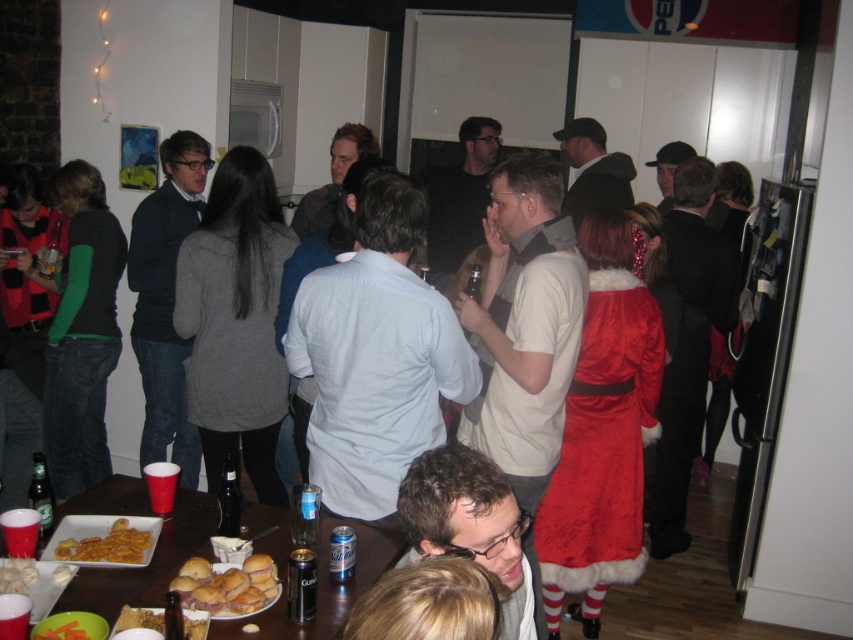
Question: Does clear glass beer at table center have a smaller size compared to golden crispy fries at lower left?

Choices:
 (A) no
 (B) yes

Answer: (A)

Question: Among these points, which one is nearest to the camera?

Choices:
 (A) (204, 564)
 (B) (41, 509)
 (C) (73, 529)

Answer: (A)

Question: Which point is closer to the camera?

Choices:
 (A) (335, 557)
 (B) (13, 573)

Answer: (B)

Question: Does clear glass beer at table center have a greater width compared to golden crispy fries at lower left?

Choices:
 (A) yes
 (B) no

Answer: (B)

Question: Does velvet red dress at center come in front of dark blue sweater at left?

Choices:
 (A) no
 (B) yes

Answer: (B)

Question: Which point is farther from the camera taking this photo?

Choices:
 (A) (206, 310)
 (B) (318, 506)
 (C) (347, 566)

Answer: (A)